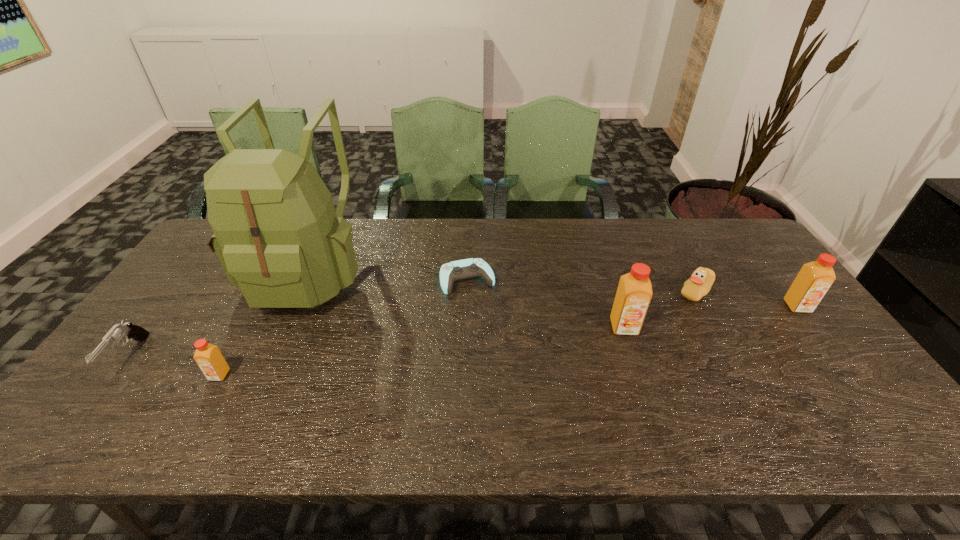
The image size is (960, 540). I want to click on gun that is at the near edge, so click(x=127, y=330).

Identify the location of object at the left edge. (127, 330).

In order to click on object located in the right edge section of the desktop in this screenshot , I will do `click(814, 279)`.

Locate an element on the screen. object that is at the near left corner is located at coordinates (127, 330).

This screenshot has height=540, width=960. What are the coordinates of `free space at the far edge of the desktop` in the screenshot? It's located at (503, 221).

You are a GUI agent. You are given a task and a screenshot of the screen. Output one action in this format:
    pyautogui.click(x=<x>, y=<y>)
    Task: Click on the blank area at the near edge
    The height and width of the screenshot is (540, 960).
    Given the screenshot: What is the action you would take?
    pyautogui.click(x=591, y=399)

In order to click on vacant space at the left edge in this screenshot , I will do `click(180, 350)`.

You are a GUI agent. You are given a task and a screenshot of the screen. Output one action in this format:
    pyautogui.click(x=<x>, y=<y>)
    Task: Click on the free space at the right edge
    This screenshot has height=540, width=960.
    Given the screenshot: What is the action you would take?
    pyautogui.click(x=829, y=360)

In the image, there is a desktop. At what (x,y) coordinates should I click in order to perform the action: click on free region at the far right corner. Please return your answer as a coordinate pair (x, y). The width and height of the screenshot is (960, 540). Looking at the image, I should click on (729, 235).

This screenshot has width=960, height=540. What are the coordinates of `vacant space that is in between the fourth object from left to right and the second nearest orange juice` in the screenshot? It's located at (545, 303).